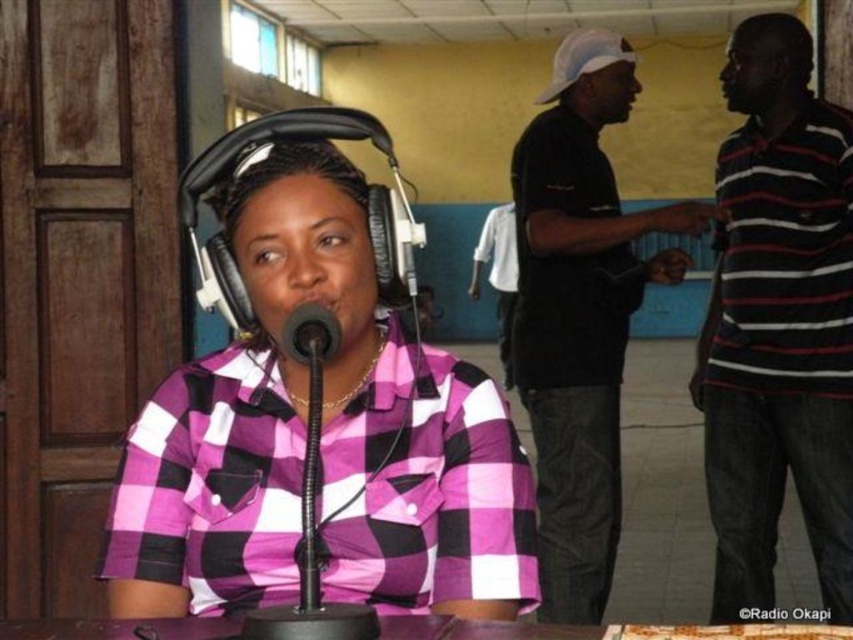
Is the position of black matte shirt at upper right less distant than that of black matte microphone at center?

No, black matte shirt at upper right is further to the viewer.

Who is taller, black matte shirt at upper right or black matte microphone at center?

black matte shirt at upper right

Locate an element on the screen. The width and height of the screenshot is (853, 640). black matte shirt at upper right is located at coordinates coord(579,312).

Find the location of a particular element. This screenshot has height=640, width=853. black matte shirt at upper right is located at coordinates (579, 312).

Between pink checkered shirt at center and black matte microphone at center, which one is positioned higher?

Positioned higher is black matte microphone at center.

Between point (236, 513) and point (305, 348), which one is positioned in front?

Point (305, 348) is in front.

Locate an element on the screen. pink checkered shirt at center is located at coordinates click(320, 440).

Where is `pink checkered shirt at center`? This screenshot has width=853, height=640. pink checkered shirt at center is located at coordinates (320, 440).

Does striped cotton shirt at right have a larger size compared to black matte microphone at center?

Yes, striped cotton shirt at right is bigger than black matte microphone at center.

You are a GUI agent. You are given a task and a screenshot of the screen. Output one action in this format:
    pyautogui.click(x=<x>, y=<y>)
    Task: Click on the striped cotton shirt at right
    The image size is (853, 640).
    Given the screenshot: What is the action you would take?
    pyautogui.click(x=778, y=323)

At what (x,y) coordinates should I click in order to perform the action: click on striped cotton shirt at right. Please return your answer as a coordinate pair (x, y). Image resolution: width=853 pixels, height=640 pixels. Looking at the image, I should click on (778, 323).